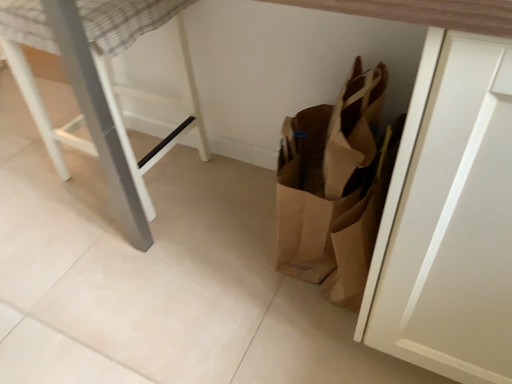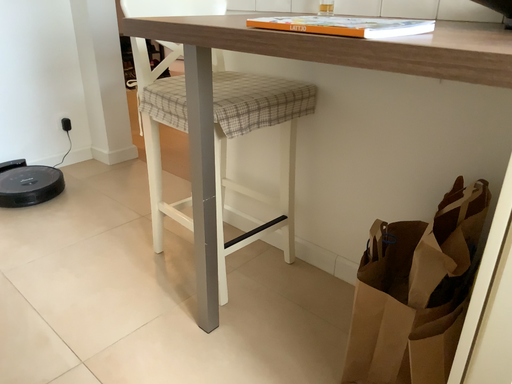
Question: Which way did the camera rotate in the video?

Choices:
 (A) rotated left
 (B) rotated right

Answer: (A)